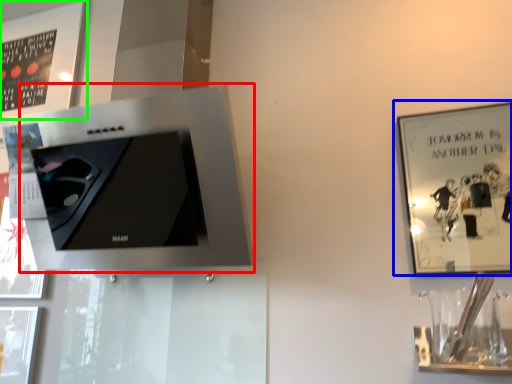
Question: Considering the real-world distances, which object is closest to appliance (highlighted by a red box)? picture frame (highlighted by a blue box) or picture frame (highlighted by a green box).

Choices:
 (A) picture frame
 (B) picture frame

Answer: (B)